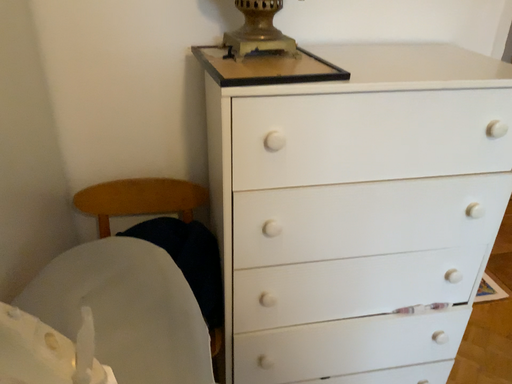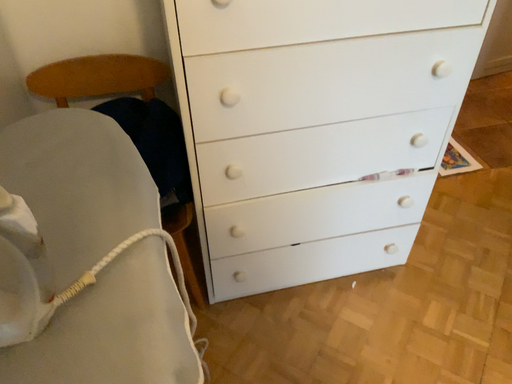
Question: How did the camera likely rotate when shooting the video?

Choices:
 (A) rotated upward
 (B) rotated downward

Answer: (B)